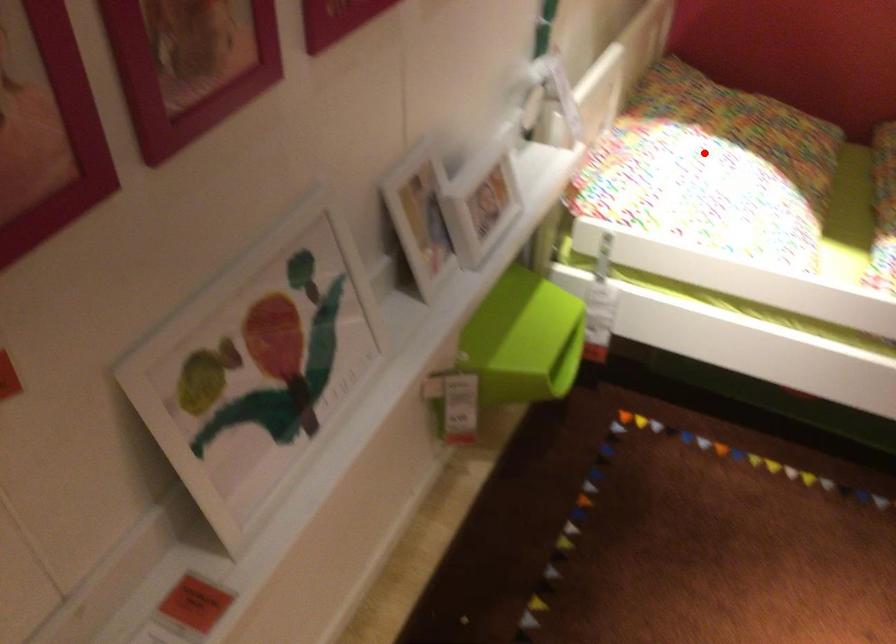
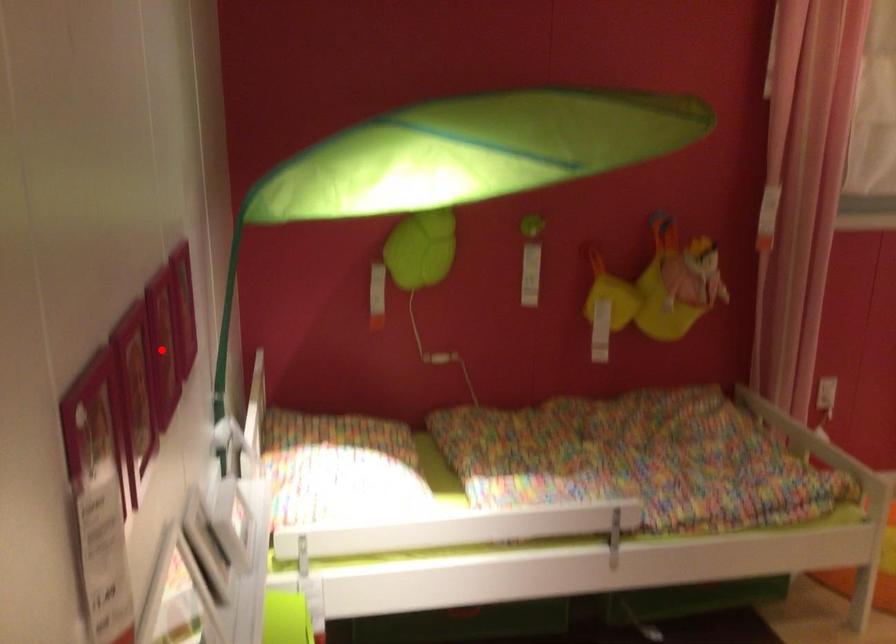
I am providing you with two images of the same scene from different viewpoints. A red point is marked on the first image and another point is marked on the second image. Is the marked point in image1 the same physical position as the marked point in image2?

No